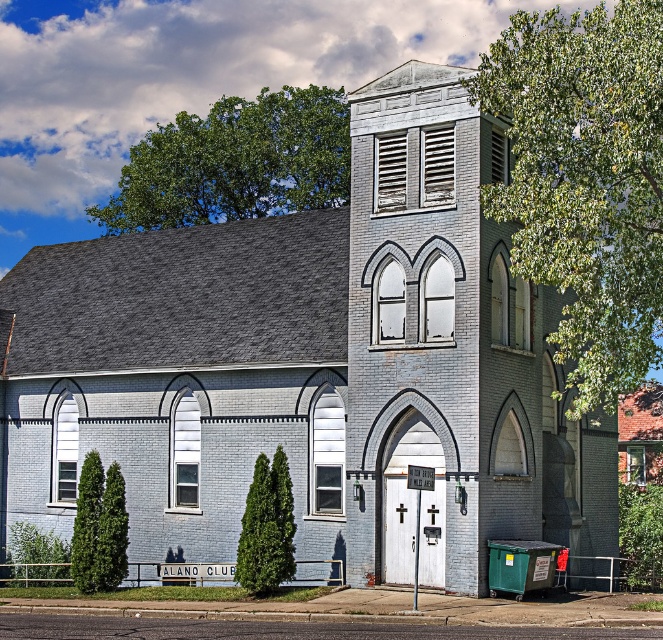
Question: Is green textured evergreen tree at center wider than green textured tree at lower left?

Choices:
 (A) yes
 (B) no

Answer: (B)

Question: Which of the following is the farthest from the observer?

Choices:
 (A) (644, 93)
 (B) (117, 508)
 (C) (143, 180)
 (D) (276, 586)

Answer: (C)

Question: Which object is farther from the camera taking this photo?

Choices:
 (A) green textured evergreen tree at center
 (B) green leafy tree at upper center

Answer: (B)

Question: Does green leafy tree at upper right appear over green leafy tree at upper center?

Choices:
 (A) yes
 (B) no

Answer: (A)

Question: Which point is farther to the camera?

Choices:
 (A) green textured tree at lower left
 (B) green textured evergreen tree at center
 (C) green leafy tree at upper center

Answer: (C)

Question: Is green leafy tree at upper right to the left of green textured evergreen tree at center from the viewer's perspective?

Choices:
 (A) no
 (B) yes

Answer: (A)